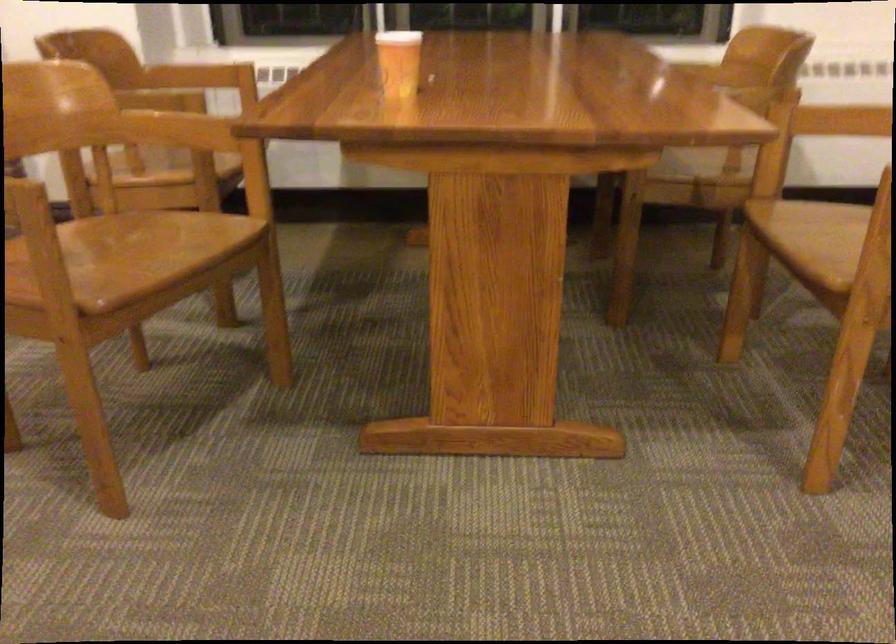
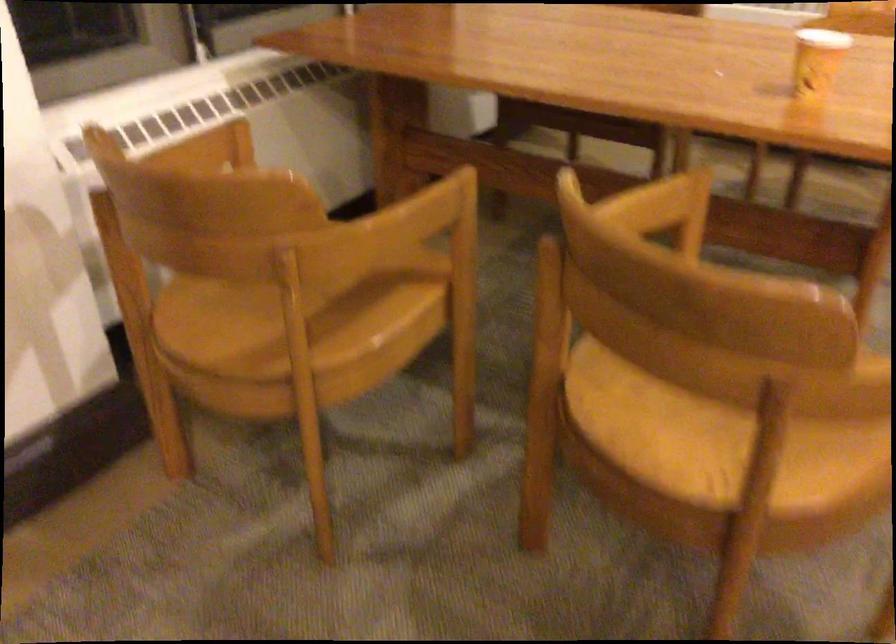
In the second image, find the point that corresponds to (x=153, y=160) in the first image.

(304, 297)